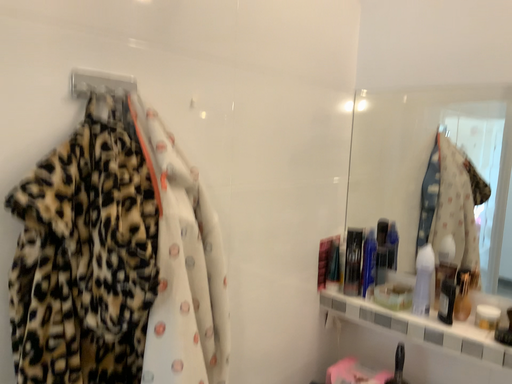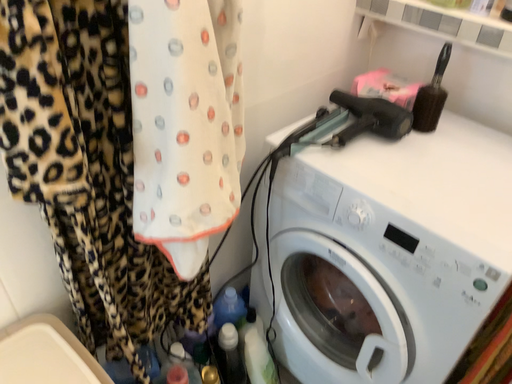
Question: How did the camera likely rotate when shooting the video?

Choices:
 (A) rotated upward
 (B) rotated downward

Answer: (B)